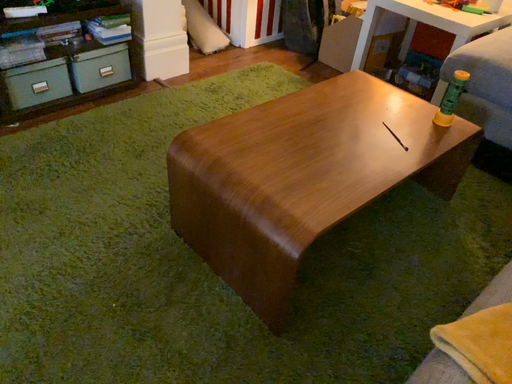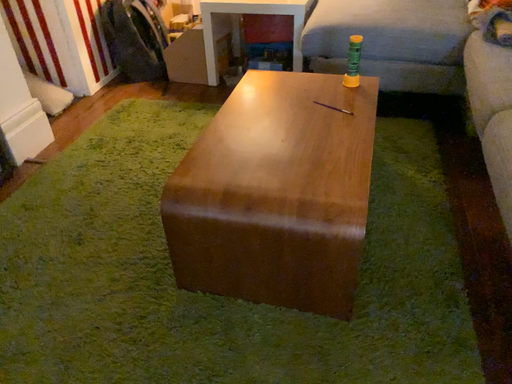
Question: Which way did the camera rotate in the video?

Choices:
 (A) rotated upward
 (B) rotated downward

Answer: (A)